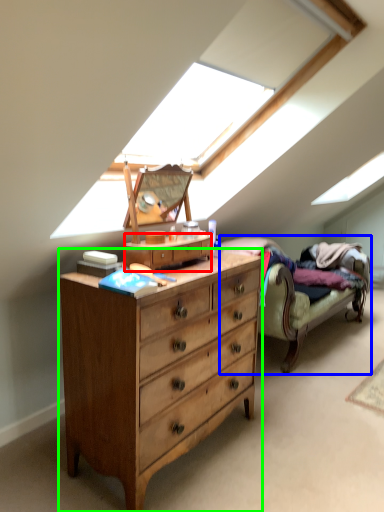
Question: Considering the real-world distances, which object is closest to file cabinet (highlighted by a red box)? studio couch (highlighted by a blue box) or chest of drawers (highlighted by a green box).

Choices:
 (A) studio couch
 (B) chest of drawers

Answer: (B)